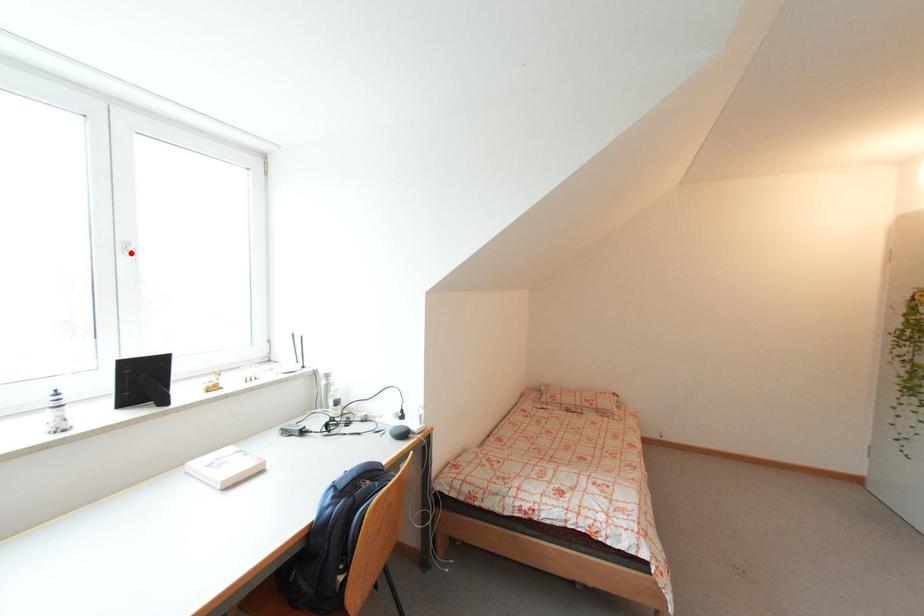
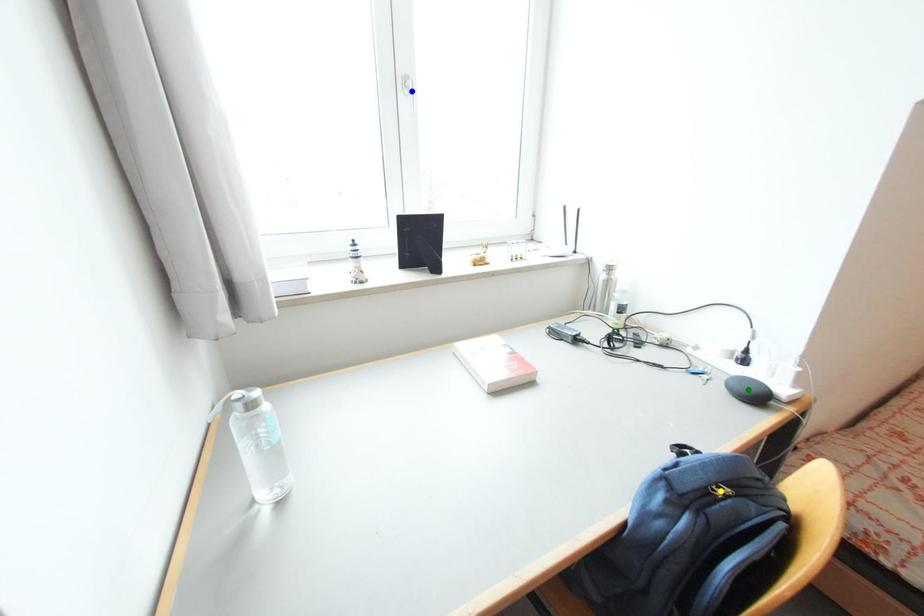
Question: I am providing you with two images of the same scene from different viewpoints. A red point is marked on the first image. You are given multiple points on the second image. In image 2, which mark is for the same physical point as the one in image 1?

Choices:
 (A) green point
 (B) blue point
 (C) yellow point

Answer: (B)